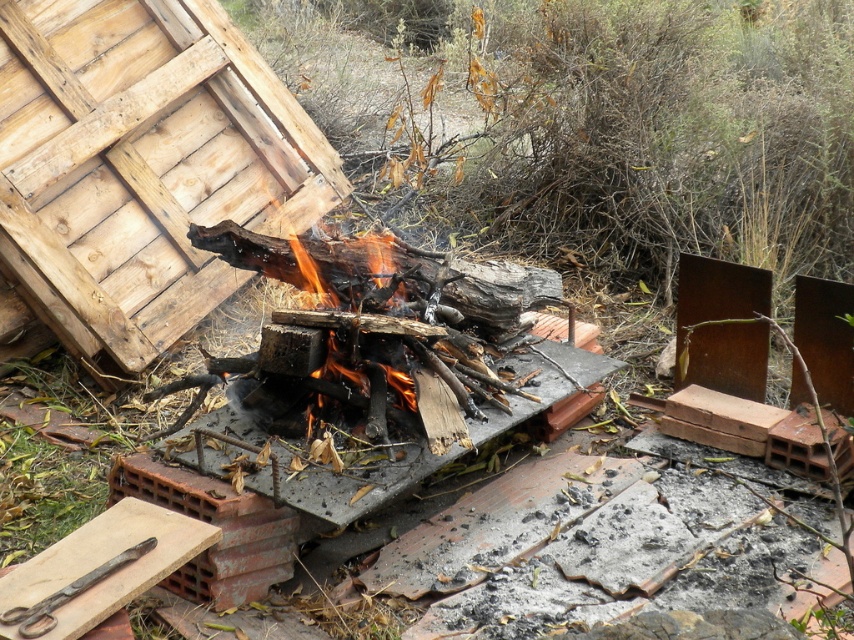
Is point (4, 173) positioned in front of point (85, 584)?

No, (4, 173) is behind (85, 584).

From the picture: Between weathered wood hut at upper left and black metal scissors at lower left, which one appears on the right side from the viewer's perspective?

black metal scissors at lower left is more to the right.

Locate an element on the screen. weathered wood hut at upper left is located at coordinates (141, 164).

Locate an element on the screen. This screenshot has height=640, width=854. weathered wood hut at upper left is located at coordinates (141, 164).